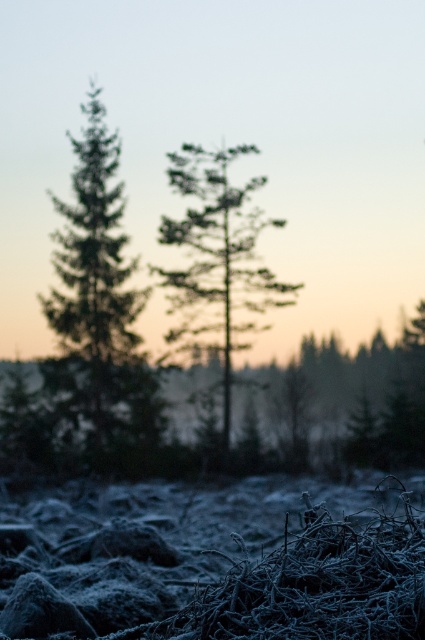
Question: Among these points, which one is farthest from the camera?

Choices:
 (A) pos(130,307)
 (B) pos(178,348)

Answer: (B)

Question: Is green needle-like tree at left closer to the viewer compared to green matte tree at center?

Choices:
 (A) yes
 (B) no

Answer: (A)

Question: Is green needle-like tree at left further to camera compared to green matte tree at center?

Choices:
 (A) yes
 (B) no

Answer: (B)

Question: Does green needle-like tree at left come behind green matte tree at center?

Choices:
 (A) yes
 (B) no

Answer: (B)